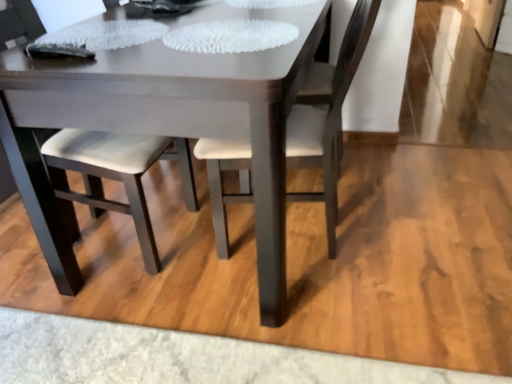
Question: Is white leather chair at center, placed as the first chair when sorted from right to left, positioned far away from matte white table at center?

Choices:
 (A) no
 (B) yes

Answer: (A)

Question: Is white leather chair at center, placed as the first chair when sorted from right to left, directly adjacent to matte white table at center?

Choices:
 (A) no
 (B) yes

Answer: (A)

Question: Considering the relative sizes of white leather chair at center, placed as the first chair when sorted from right to left, and matte white table at center in the image provided, is white leather chair at center, placed as the first chair when sorted from right to left, smaller than matte white table at center?

Choices:
 (A) no
 (B) yes

Answer: (B)

Question: Is white leather chair at center, which is the 2th chair in left-to-right order, to the right of matte white table at center from the viewer's perspective?

Choices:
 (A) yes
 (B) no

Answer: (A)

Question: Does white leather chair at center, which is the 2th chair in left-to-right order, lie behind matte white table at center?

Choices:
 (A) no
 (B) yes

Answer: (B)

Question: From a real-world perspective, relative to white leather chair at center, placed as the first chair when sorted from right to left, is matte white chair at center, which appears as the 2th chair when viewed from the right, vertically above or below?

Choices:
 (A) above
 (B) below

Answer: (A)

Question: Is matte white chair at center, which appears as the 2th chair when viewed from the right, wider or thinner than white leather chair at center, which is the 2th chair in left-to-right order?

Choices:
 (A) thin
 (B) wide

Answer: (A)

Question: From their relative heights in the image, would you say matte white chair at center, which appears as the 2th chair when viewed from the right, is taller or shorter than white leather chair at center, which is the 2th chair in left-to-right order?

Choices:
 (A) short
 (B) tall

Answer: (B)

Question: From the image's perspective, relative to white leather chair at center, placed as the first chair when sorted from right to left, is matte white chair at center, placed as the 1th chair when sorted from left to right, above or below?

Choices:
 (A) below
 (B) above

Answer: (A)

Question: From the image's perspective, is white leather chair at center, placed as the first chair when sorted from right to left, above or below matte white table at center?

Choices:
 (A) above
 (B) below

Answer: (B)

Question: Considering the positions of point (329, 79) and point (192, 61), is point (329, 79) closer or farther from the camera than point (192, 61)?

Choices:
 (A) farther
 (B) closer

Answer: (A)

Question: Is white leather chair at center, which is the 2th chair in left-to-right order, wider or thinner than matte white table at center?

Choices:
 (A) thin
 (B) wide

Answer: (A)

Question: Would you say white leather chair at center, which is the 2th chair in left-to-right order, is inside or outside matte white table at center?

Choices:
 (A) inside
 (B) outside

Answer: (A)

Question: Is matte white table at center to the left or to the right of white leather chair at center, which is the 2th chair in left-to-right order, in the image?

Choices:
 (A) left
 (B) right

Answer: (A)

Question: Looking at their shapes, would you say matte white table at center is wider or thinner than white leather chair at center, which is the 2th chair in left-to-right order?

Choices:
 (A) wide
 (B) thin

Answer: (A)